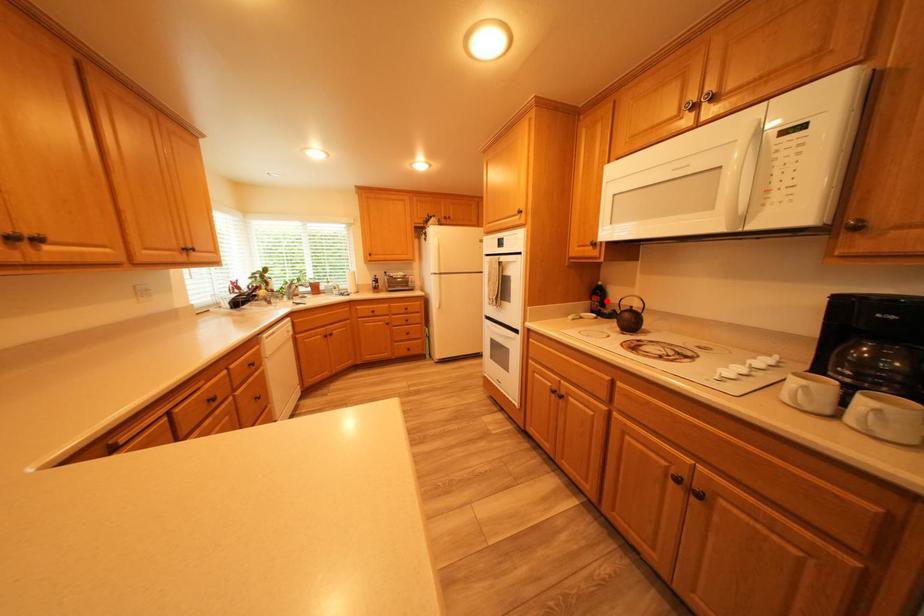
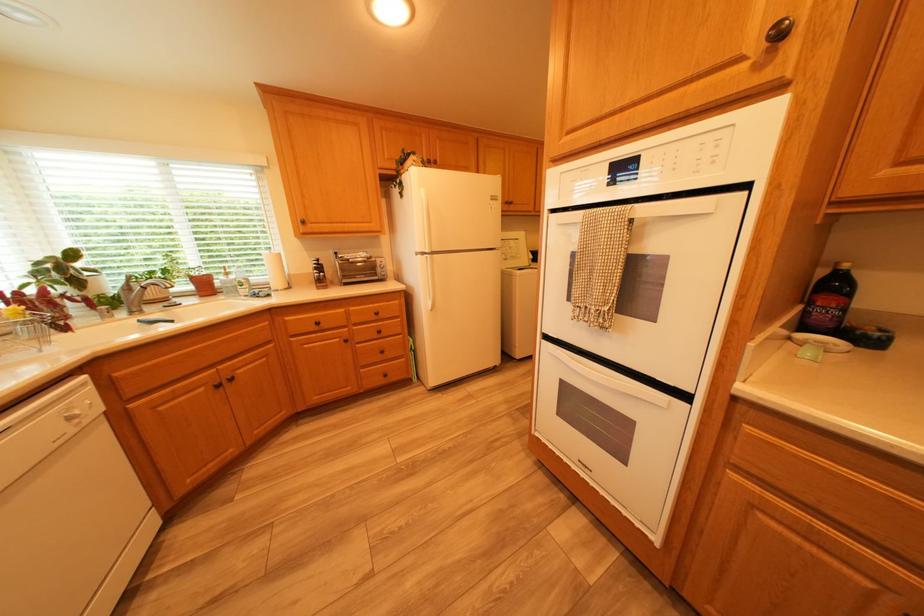
Locate, in the second image, the point that corresponds to the highlighted location in the first image.

(832, 305)